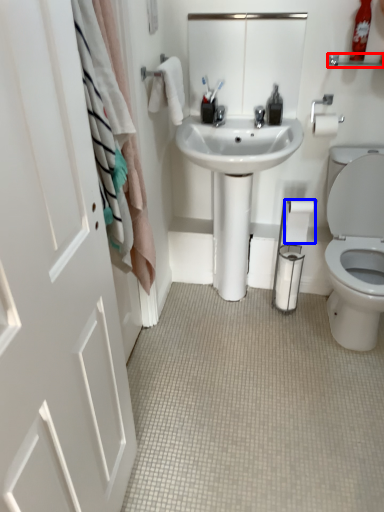
Question: Which object appears farthest to the camera in this image, balustrade (highlighted by a red box) or toilet paper (highlighted by a blue box)?

Choices:
 (A) balustrade
 (B) toilet paper

Answer: (B)